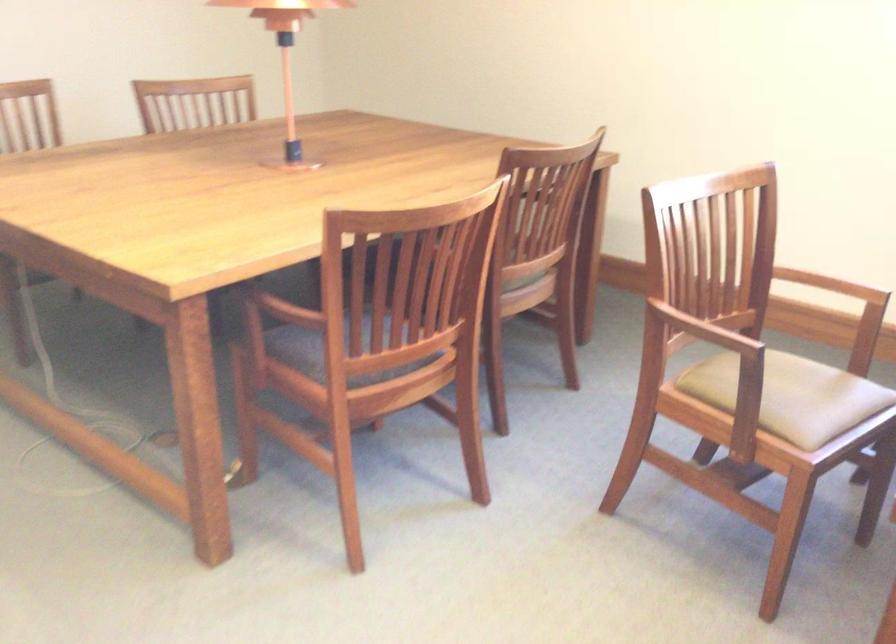
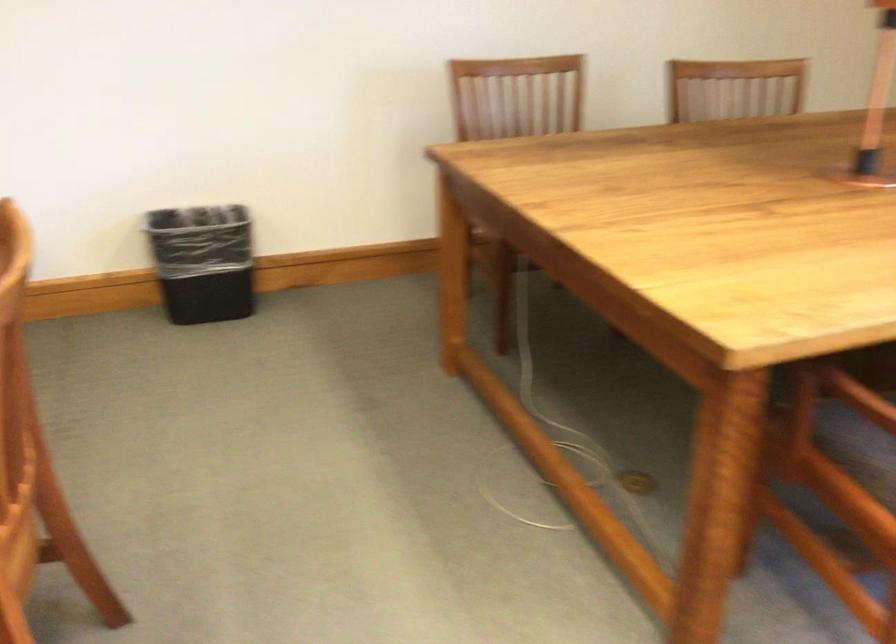
Question: The camera is either moving clockwise (left) or counter-clockwise (right) around the object. The first image is from the beginning of the video and the second image is from the end. Is the camera moving left or right when shooting the video?

Choices:
 (A) Left
 (B) Right

Answer: (B)